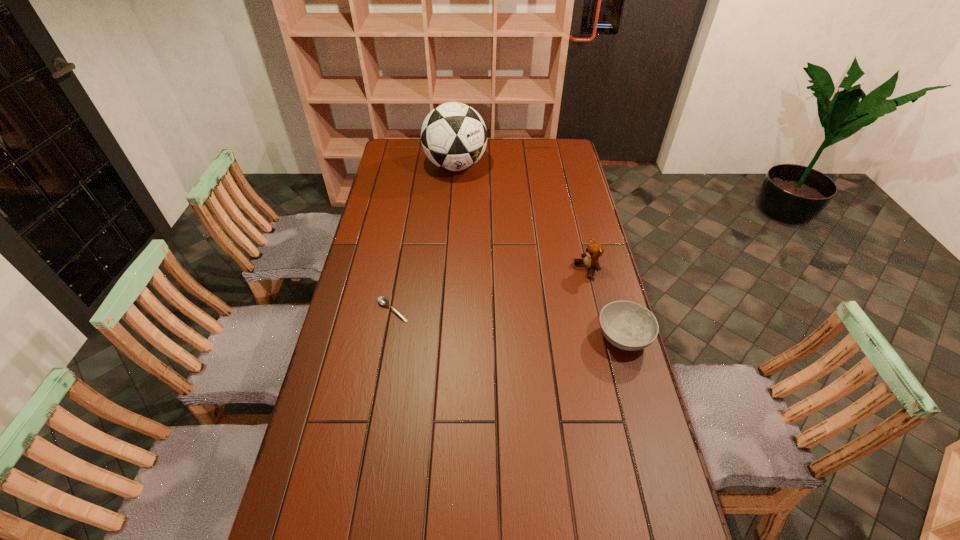
Find the location of a particular element. the shortest object is located at coordinates (383, 301).

Where is `the second shortest object`? The height and width of the screenshot is (540, 960). the second shortest object is located at coordinates (627, 325).

This screenshot has height=540, width=960. Identify the location of the tallest object. (453, 135).

Identify the location of the farthest object. tap(453, 135).

Locate an element on the screen. the second tallest object is located at coordinates (594, 250).

In order to click on teddy bear in this screenshot , I will do `click(594, 250)`.

Image resolution: width=960 pixels, height=540 pixels. Find the location of `blank area located 0.060m on the front of the shortest object`. blank area located 0.060m on the front of the shortest object is located at coordinates tap(388, 338).

Where is `vacant region located 0.390m on the front of the bowl`? vacant region located 0.390m on the front of the bowl is located at coordinates (668, 496).

Locate an element on the screen. The image size is (960, 540). vacant area located 0.320m on the surface of the tallest object where the brand logo is visible is located at coordinates (469, 229).

At what (x,y) coordinates should I click in order to perform the action: click on free space located 0.200m on the surface of the tallest object where the brand logo is visible. Please return your answer as a coordinate pair (x, y). The image size is (960, 540). Looking at the image, I should click on (465, 211).